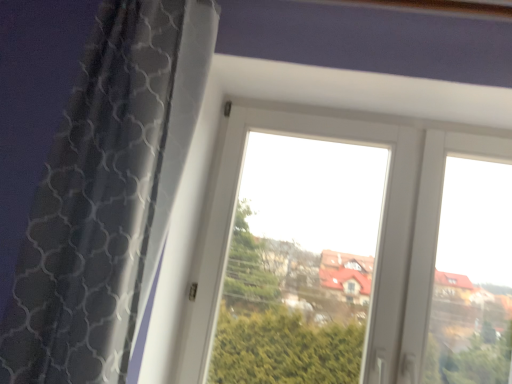
At what (x,y) coordinates should I click in order to perform the action: click on black mesh curtain at left. Please return your answer as a coordinate pair (x, y). This screenshot has width=512, height=384. Looking at the image, I should click on (106, 194).

What do you see at coordinates (106, 194) in the screenshot?
I see `black mesh curtain at left` at bounding box center [106, 194].

The width and height of the screenshot is (512, 384). Find the location of `transparent glass window at center`. transparent glass window at center is located at coordinates pyautogui.click(x=380, y=224).

What do you see at coordinates (380, 224) in the screenshot?
I see `transparent glass window at center` at bounding box center [380, 224].

Identify the location of black mesh curtain at left. Image resolution: width=512 pixels, height=384 pixels. (106, 194).

Considering the positions of objects transparent glass window at center and black mesh curtain at left in the image provided, who is more to the right, transparent glass window at center or black mesh curtain at left?

transparent glass window at center is more to the right.

Which object is further away from the camera taking this photo, transparent glass window at center or black mesh curtain at left?

Answer: transparent glass window at center is further from the camera.

Does point (231, 119) come behind point (26, 358)?

Yes.

From the image's perspective, would you say transparent glass window at center is positioned over black mesh curtain at left?

No.

From a real-world perspective, relative to black mesh curtain at left, is transparent glass window at center vertically above or below?

From a real-world perspective, transparent glass window at center is physically below black mesh curtain at left.

Which object is thinner, transparent glass window at center or black mesh curtain at left?

transparent glass window at center is thinner.

Which of these two, transparent glass window at center or black mesh curtain at left, stands shorter?

Standing shorter between the two is transparent glass window at center.

Can you confirm if transparent glass window at center is smaller than black mesh curtain at left?

Incorrect, transparent glass window at center is not smaller in size than black mesh curtain at left.

Would you say black mesh curtain at left is part of transparent glass window at center's contents?

No, black mesh curtain at left is not a part of transparent glass window at center.

Does transparent glass window at center touch black mesh curtain at left?

No, transparent glass window at center is not next to black mesh curtain at left.

Could you tell me if transparent glass window at center is turned towards black mesh curtain at left?

Yes, transparent glass window at center is facing black mesh curtain at left.

Locate an element on the screen. This screenshot has height=384, width=512. curtain in front of the transparent glass window at center is located at coordinates (106, 194).

Would you say black mesh curtain at left is to the left or to the right of transparent glass window at center in the picture?

From the image, it's evident that black mesh curtain at left is to the left of transparent glass window at center.

From the picture: Does black mesh curtain at left come in front of transparent glass window at center?

That is True.

Does point (42, 195) appear closer or farther from the camera than point (407, 332)?

Point (42, 195) is closer to the camera than point (407, 332).

From the image's perspective, who appears lower, black mesh curtain at left or transparent glass window at center?

transparent glass window at center, from the image's perspective.

From a real-world perspective, is black mesh curtain at left below transparent glass window at center?

No, from a real-world perspective, black mesh curtain at left is not under transparent glass window at center.

Does black mesh curtain at left have a greater width compared to transparent glass window at center?

Yes.

Considering the sizes of black mesh curtain at left and transparent glass window at center in the image, is black mesh curtain at left taller or shorter than transparent glass window at center?

Considering their sizes, black mesh curtain at left has more height than transparent glass window at center.

Consider the image. Between black mesh curtain at left and transparent glass window at center, which one has larger size?

transparent glass window at center is bigger.

Is transparent glass window at center inside black mesh curtain at left?

That's incorrect, transparent glass window at center is not inside black mesh curtain at left.

Is the surface of black mesh curtain at left in direct contact with transparent glass window at center?

No, black mesh curtain at left is not touching transparent glass window at center.

Is black mesh curtain at left oriented away from transparent glass window at center?

No, transparent glass window at center is not at the back of black mesh curtain at left.

How many degrees apart are the facing directions of black mesh curtain at left and transparent glass window at center?

There is a 4.37-degree angle between the facing directions of black mesh curtain at left and transparent glass window at center.

I want to click on curtain above the transparent glass window at center (from a real-world perspective), so click(x=106, y=194).

Find the location of a particular element. curtain lying above the transparent glass window at center (from the image's perspective) is located at coordinates (106, 194).

Find the location of `curtain in front of the transparent glass window at center`. curtain in front of the transparent glass window at center is located at coordinates (106, 194).